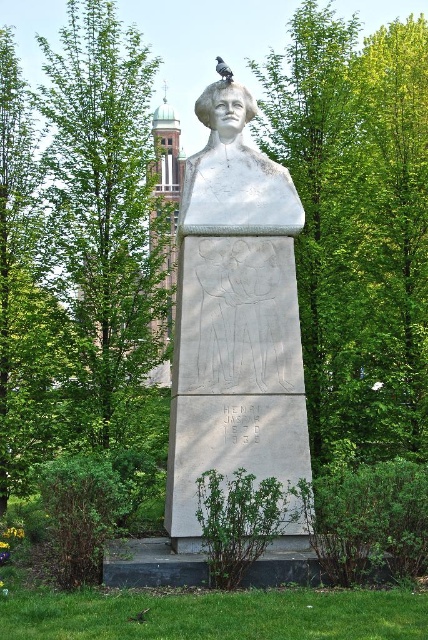
Question: Does white stone bust at center have a greater width compared to white marble bust at upper center?

Choices:
 (A) no
 (B) yes

Answer: (B)

Question: Estimate the real-world distances between objects in this image. Which object is closer to the green leafy tree at upper left?

Choices:
 (A) white stone bust at center
 (B) white marble bust at upper center

Answer: (A)

Question: Considering the relative positions of white stone bust at center and green leafy tree at upper left in the image provided, where is white stone bust at center located with respect to green leafy tree at upper left?

Choices:
 (A) below
 (B) above

Answer: (A)

Question: Which object is positioned farthest from the white marble bust at upper center?

Choices:
 (A) green leafy tree at upper left
 (B) white stone bust at center

Answer: (A)

Question: Can you confirm if white stone bust at center is bigger than white marble bust at upper center?

Choices:
 (A) no
 (B) yes

Answer: (B)

Question: Which of the following is the closest to the observer?

Choices:
 (A) white marble bust at upper center
 (B) green leafy tree at upper left
 (C) white stone bust at center

Answer: (C)